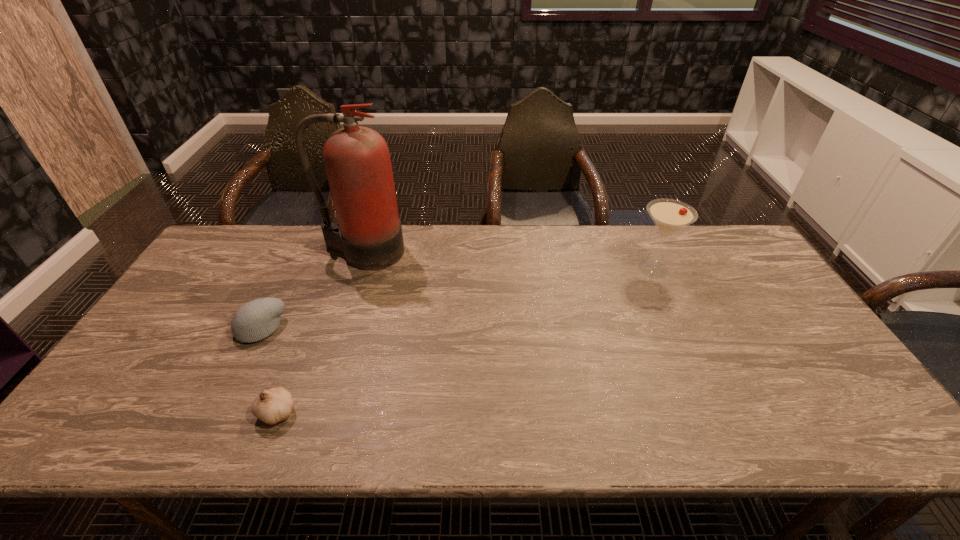
This screenshot has width=960, height=540. I want to click on fire extinguisher that is at the far edge, so click(357, 161).

Find the location of a particular element. martini that is at the far edge is located at coordinates tap(669, 215).

I want to click on object that is at the near edge, so click(x=272, y=406).

In the image, there is a desktop. Where is `free space at the far edge`? This screenshot has height=540, width=960. free space at the far edge is located at coordinates (468, 248).

In order to click on free space at the near edge of the desktop in this screenshot , I will do pos(350,423).

The height and width of the screenshot is (540, 960). I want to click on free space at the left edge, so click(116, 404).

Identify the location of vacant space at the far right corner. This screenshot has width=960, height=540. (721, 238).

Identify the location of free point between the beanie and the martini. This screenshot has width=960, height=540. (457, 299).

Find the location of a particular element. The image size is (960, 540). free space between the beanie and the rightmost object is located at coordinates (457, 299).

Locate an element on the screen. The image size is (960, 540). unoccupied area between the fire extinguisher and the leftmost object is located at coordinates (311, 290).